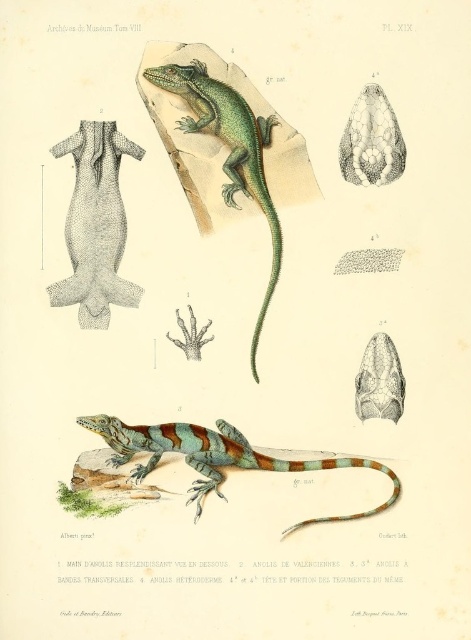
Does gray textured tail at center lie behind green glossy lizard at upper center?

Yes, gray textured tail at center is behind green glossy lizard at upper center.

Is gray textured tail at center wider than green glossy lizard at upper center?

Incorrect, gray textured tail at center's width does not surpass green glossy lizard at upper center's.

Who is more forward, (123,224) or (201,76)?

Point (201,76) is in front.

Locate an element on the screen. The height and width of the screenshot is (640, 471). gray textured tail at center is located at coordinates (x=96, y=225).

Between gray textured tail at center and multicolored painted lizard at center, which one has more height?

gray textured tail at center

Does gray textured tail at center have a greater height compared to multicolored painted lizard at center?

Indeed, gray textured tail at center has a greater height compared to multicolored painted lizard at center.

Is point (83, 150) less distant than point (139, 432)?

That is False.

This screenshot has width=471, height=640. In order to click on gray textured tail at center in this screenshot , I will do `click(96, 225)`.

What do you see at coordinates (216, 458) in the screenshot? The width and height of the screenshot is (471, 640). I see `multicolored painted lizard at center` at bounding box center [216, 458].

Who is positioned more to the left, multicolored painted lizard at center or green glossy lizard at upper center?

Positioned to the left is multicolored painted lizard at center.

Who is more forward, (305,518) or (259,193)?

Point (305,518)

I want to click on multicolored painted lizard at center, so click(216, 458).